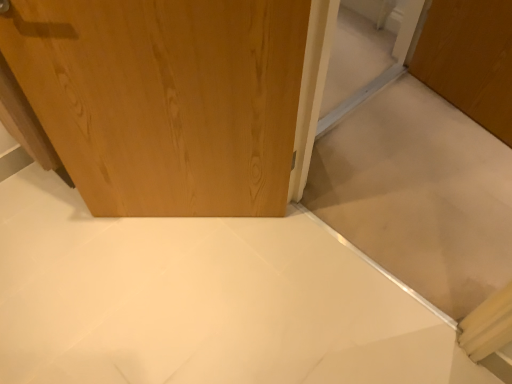
This screenshot has height=384, width=512. I want to click on vacant space situated on the left part of wooden door at upper left, so click(58, 244).